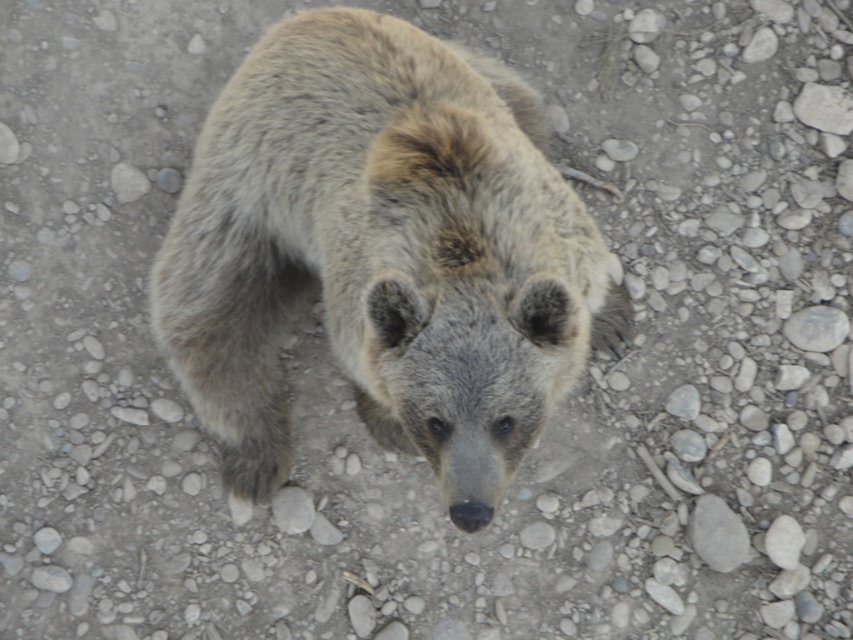
Between fuzzy fur bear at center and gray smooth rock at center-right, which one is positioned higher?

fuzzy fur bear at center is above.

Is fuzzy fur bear at center to the left of gray smooth rock at center-right from the viewer's perspective?

Correct, you'll find fuzzy fur bear at center to the left of gray smooth rock at center-right.

Locate an element on the screen. fuzzy fur bear at center is located at coordinates (381, 253).

Is gray smooth rock at lower right shorter than gray smooth rock at center-right?

No, gray smooth rock at lower right is not shorter than gray smooth rock at center-right.

Who is more forward, (708,496) or (842,323)?

Point (708,496) is in front.

The width and height of the screenshot is (853, 640). In order to click on gray smooth rock at lower right in this screenshot , I will do `click(717, 532)`.

Between fuzzy fur bear at center and gray smooth rock at lower right, which one appears on the right side from the viewer's perspective?

gray smooth rock at lower right is more to the right.

Describe the element at coordinates (381, 253) in the screenshot. I see `fuzzy fur bear at center` at that location.

Does point (358, 228) lie in front of point (695, 552)?

That is True.

In order to click on fuzzy fur bear at center in this screenshot , I will do `click(381, 253)`.